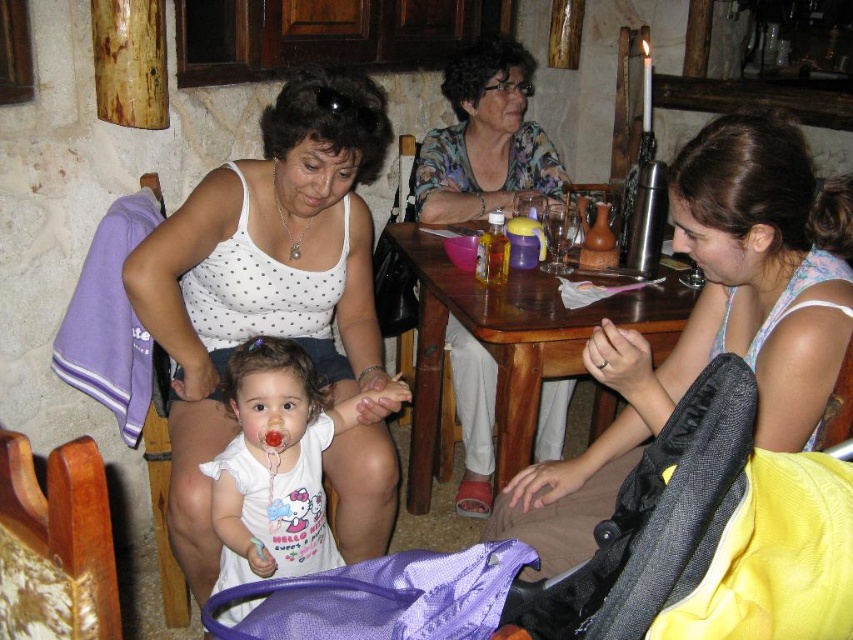
Can you confirm if floral fabric blouse at upper center is positioned to the left of white cotton shirt at center?

Incorrect, floral fabric blouse at upper center is not on the left side of white cotton shirt at center.

Does floral fabric blouse at upper center have a lesser width compared to white cotton shirt at center?

In fact, floral fabric blouse at upper center might be wider than white cotton shirt at center.

Is point (474, 86) positioned after point (224, 529)?

Yes, point (474, 86) is behind point (224, 529).

Find the location of a particular element. Image resolution: width=853 pixels, height=640 pixels. floral fabric blouse at upper center is located at coordinates (485, 140).

Is white dotted tank top at center further to camera compared to matte white tank top at center?

Yes, white dotted tank top at center is further from the viewer.

Is white dotted tank top at center above matte white tank top at center?

Yes.

Image resolution: width=853 pixels, height=640 pixels. I want to click on white dotted tank top at center, so click(263, 276).

The width and height of the screenshot is (853, 640). I want to click on white dotted tank top at center, so click(x=263, y=276).

Can you confirm if white dotted tank top at center is positioned above wooden table at center?

Yes, white dotted tank top at center is above wooden table at center.

The height and width of the screenshot is (640, 853). What do you see at coordinates (263, 276) in the screenshot?
I see `white dotted tank top at center` at bounding box center [263, 276].

The width and height of the screenshot is (853, 640). What do you see at coordinates (263, 276) in the screenshot? I see `white dotted tank top at center` at bounding box center [263, 276].

I want to click on white dotted tank top at center, so click(x=263, y=276).